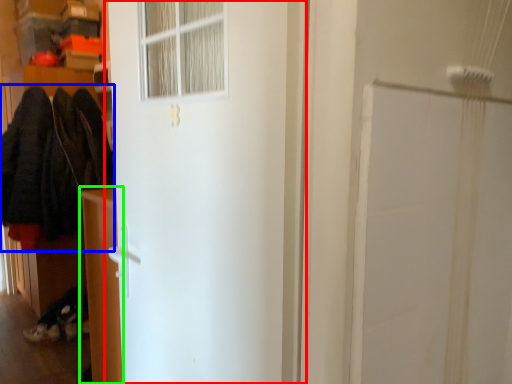
Question: Estimate the real-world distances between objects in this image. Which object is farther from door (highlighted by a red box), clothing (highlighted by a blue box) or furniture (highlighted by a green box)?

Choices:
 (A) clothing
 (B) furniture

Answer: (A)